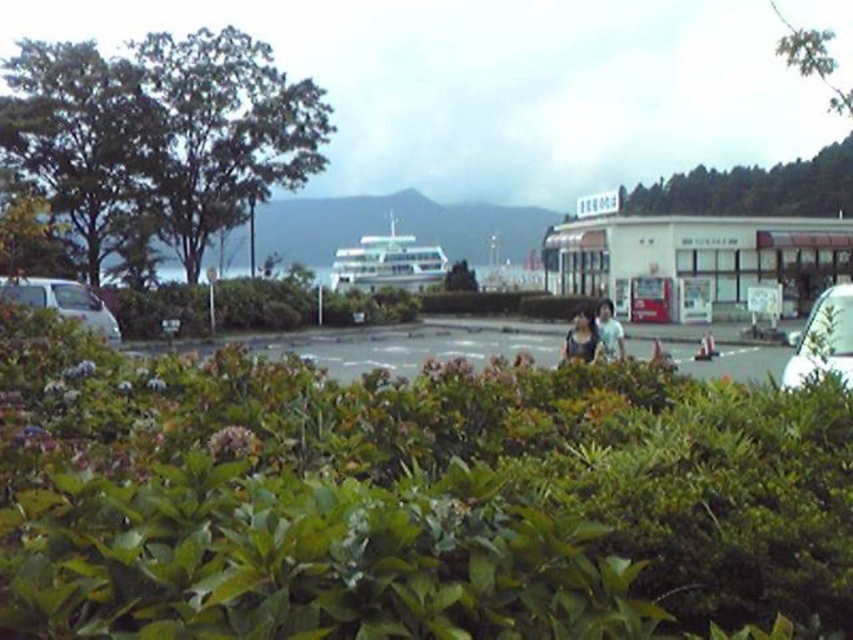
From the picture: You are standing at the point marked by coordinates point (62, 301). Which object is directly in front of you?

The white matte van at left is located at point (62, 301), so the white matte van at left is directly in front of you.

You are standing at the point marked by coordinates point at (787, 365) in the image. You want to walk straight towards the cruise ship in the background. Is the cruise ship located in front of or behind you relative to your current position?

The cruise ship is located behind you because the point at (787, 365) is where you are standing, and the cruise ship is in the background of the image. Since you want to walk straight towards the cruise ship, it would be in front of you. However, according to the description, the cruise ship is docked in the background, so relative to your position at point at (787, 365), the cruise ship is in front of you.